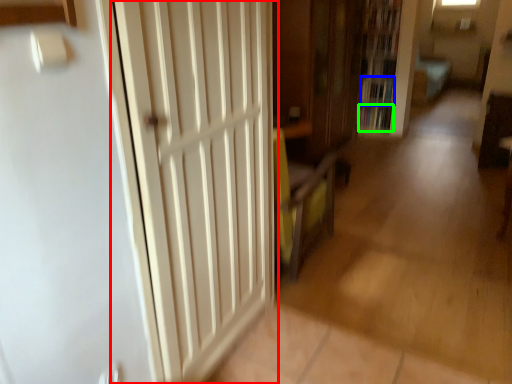
Question: Estimate the real-world distances between objects in this image. Which object is farther from door (highlighted by a red box), book (highlighted by a blue box) or book (highlighted by a green box)?

Choices:
 (A) book
 (B) book

Answer: (B)